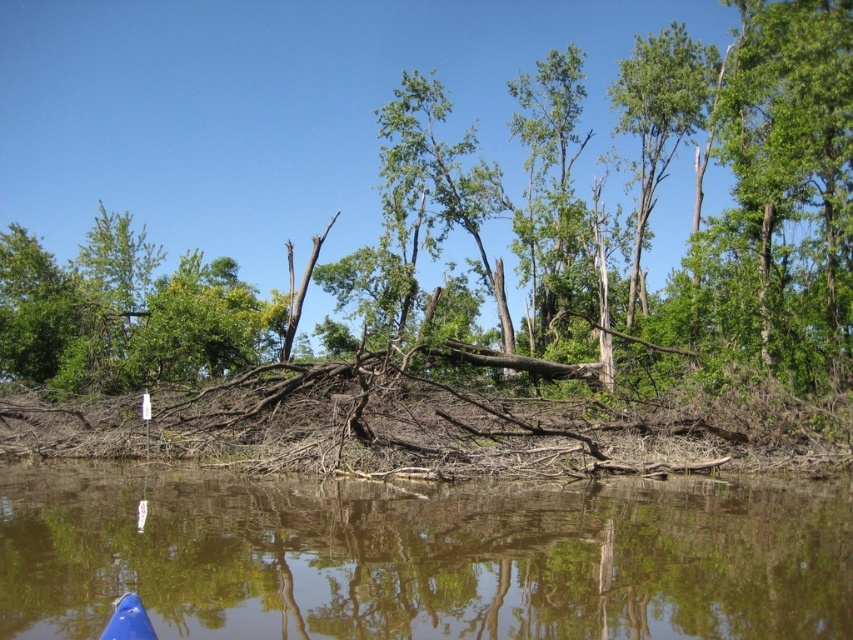
Which is below, brown rough wood at center or brown wood at lower center?

Positioned lower is brown wood at lower center.

Is point (653, 296) positioned before point (247, 522)?

No, (653, 296) is further to viewer.

Who is more forward, (x=9, y=12) or (x=749, y=506)?

Point (x=749, y=506) is more forward.

I want to click on brown rough wood at center, so click(461, 161).